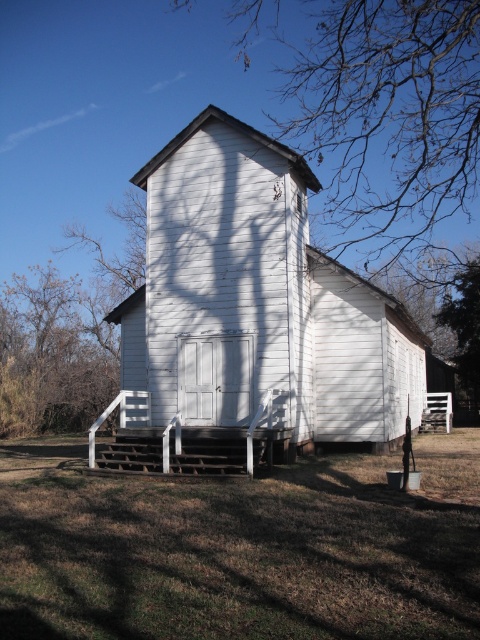
You are a landscape architect designing a new garden around the church. You need to know the relative widths of the bare branches at upper center and the green leafy tree at right to plan spacing between plants. Which object has a greater width?

The bare branches at upper center has a greater width than the green leafy tree at right according to the description.

You are standing in front of a historic church and want to take a photo of the point at coordinate (x=324, y=284). Your camera has a maximum focus range of 15 meters. Will you be able to focus on the point?

The distance of point (x=324, y=284) from the camera is 16.30 meters, which exceeds the camera maximum focus range of 15 meters. Therefore, the camera cannot focus on the point.